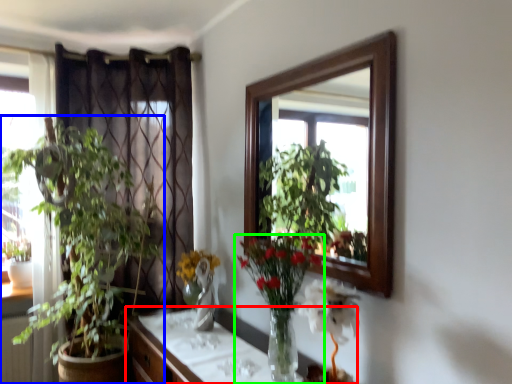
Question: Which object is positioned farthest from cabinetry (highlighted by a red box)? Select from houseplant (highlighted by a blue box) and houseplant (highlighted by a green box).

Choices:
 (A) houseplant
 (B) houseplant

Answer: (A)